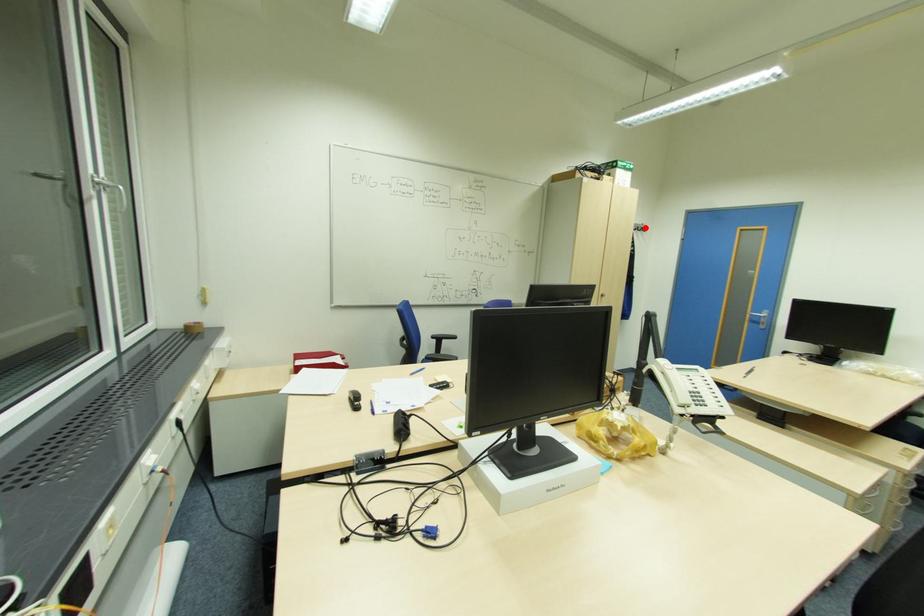
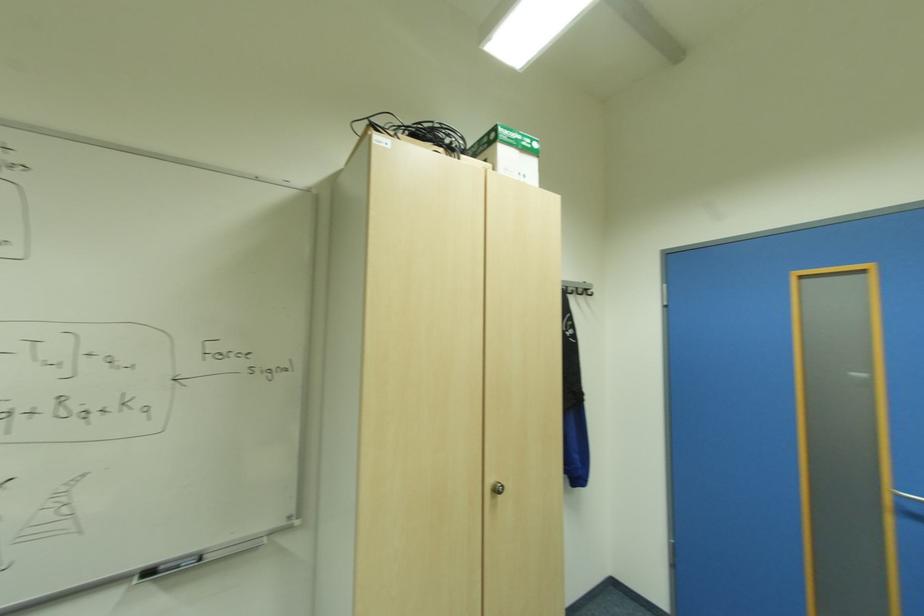
Find the pixel in the second image that matches the highlighted location in the first image.

(588, 291)